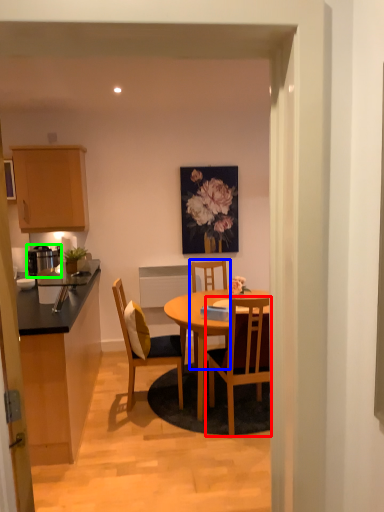
Question: Which object is positioned farthest from chair (highlighted by a red box)? Select from chair (highlighted by a blue box) and appliance (highlighted by a green box).

Choices:
 (A) chair
 (B) appliance

Answer: (B)